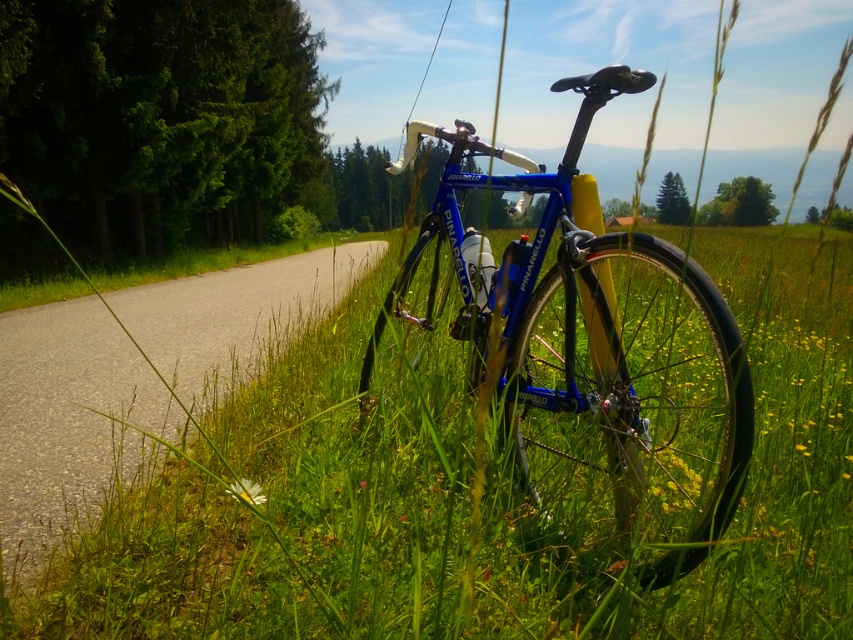
You are a cyclist who wants to park your blue metallic bicycle at center near the asphalt road at center. Based on the scene, where should you position the bicycle relative to the road?

The blue metallic bicycle at center should be placed to the right of the asphalt road at center as per the scene description.

You are a photographer planning to capture the blue metallic bicycle at center and the asphalt road at center in a single shot. Based on their heights, which object will appear shorter in the photo?

The blue metallic bicycle at center is not as tall as the asphalt road at center, so it will appear shorter in the photo.